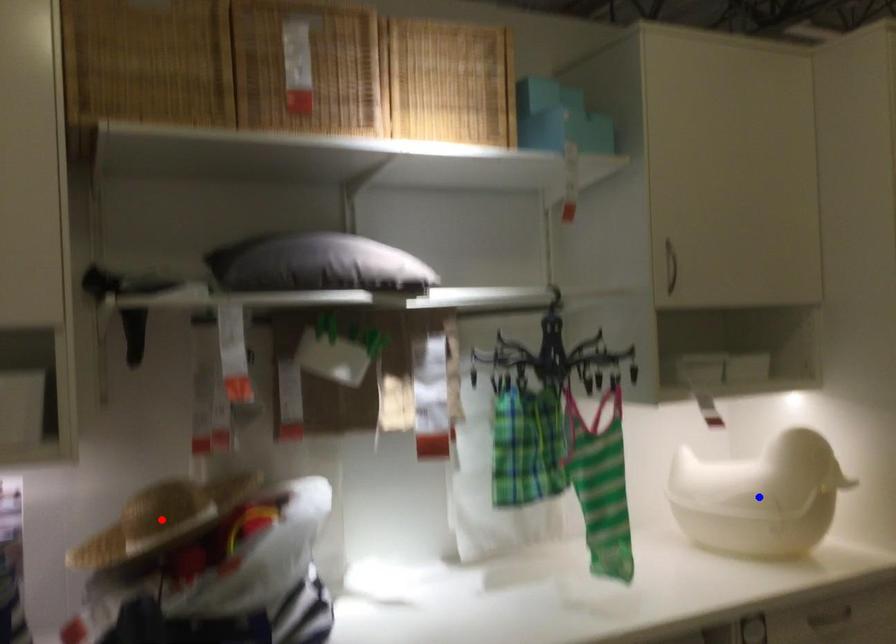
Question: Two points are marked on the image. Which point is closer to the camera?

Choices:
 (A) Blue point is closer.
 (B) Red point is closer.

Answer: (B)